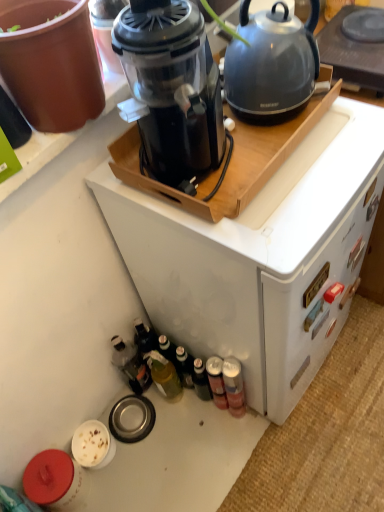
Measure the distance between metallic silver can at lower right, which is the third bottle from left to right, and camera.

metallic silver can at lower right, which is the third bottle from left to right, is 1.17 meters from camera.

In order to face metallic silver can at lower right, which is the third bottle from left to right, should I rotate leftwards or rightwards?

Turn right approximately 3.582 degrees to face it.

What is the approximate width of metallic silver can at lower right, the first bottle positioned from the right?

metallic silver can at lower right, the first bottle positioned from the right, is 2.70 inches in width.

Where is `translucent glass bottle at lower center, which is the 3th bottle from right to left`? translucent glass bottle at lower center, which is the 3th bottle from right to left is located at coordinates (164, 376).

Image resolution: width=384 pixels, height=512 pixels. What are the coordinates of `matte gray kettle at upper right` in the screenshot? It's located at (352, 53).

What are the coordinates of `metallic gray kettle at upper right` in the screenshot? It's located at (271, 64).

Locate an element on the screen. This screenshot has width=384, height=512. black plastic blender at upper center is located at coordinates (172, 86).

Describe the element at coordinates (172, 86) in the screenshot. The width and height of the screenshot is (384, 512). I see `black plastic blender at upper center` at that location.

Where is `metallic silver can at lower right, marked as the 2th bottle in a right-to-left arrangement`? The width and height of the screenshot is (384, 512). metallic silver can at lower right, marked as the 2th bottle in a right-to-left arrangement is located at coordinates (216, 381).

Would you consider metallic gray kettle at upper right to be distant from translucent glass bottle at lower center, the 2th bottle positioned from the left?

No, there isn't a large distance between metallic gray kettle at upper right and translucent glass bottle at lower center, the 2th bottle positioned from the left.

Between metallic gray kettle at upper right and translucent glass bottle at lower center, which is the 3th bottle from right to left, which one appears on the left side from the viewer's perspective?

From the viewer's perspective, translucent glass bottle at lower center, which is the 3th bottle from right to left, appears more on the left side.

From a real-world perspective, does metallic gray kettle at upper right stand above translucent glass bottle at lower center, the 2th bottle positioned from the left?

Yes.

Which is in front, metallic gray kettle at upper right or translucent glass bottle at lower center, the 2th bottle positioned from the left?

Positioned in front is metallic gray kettle at upper right.

From the metallic silver can at lower right, the first bottle positioned from the right, count the 1st bottle to the left and point to it. Please provide its 2D coordinates.

[(216, 381)]

Which is behind, point (235, 398) or point (217, 395)?

The point (217, 395) is farther.

Consider the image. Measure the distance between metallic silver can at lower right, which is the 4th bottle from left to right, and metallic silver can at lower right, which is the third bottle from left to right.

metallic silver can at lower right, which is the 4th bottle from left to right, is 1.38 inches away from metallic silver can at lower right, which is the third bottle from left to right.

From a real-world perspective, which object stands above the other?

metallic silver can at lower right, the first bottle positioned from the right.

Is metallic silver can at lower right, which is the third bottle from left to right, touching translucent glass bottle at lower center, the 2th bottle positioned from the left?

No, metallic silver can at lower right, which is the third bottle from left to right, is not in contact with translucent glass bottle at lower center, the 2th bottle positioned from the left.

From a real-world perspective, is metallic silver can at lower right, which is the third bottle from left to right, beneath translucent glass bottle at lower center, which is the 3th bottle from right to left?

Indeed, from a real-world perspective, metallic silver can at lower right, which is the third bottle from left to right, is positioned beneath translucent glass bottle at lower center, which is the 3th bottle from right to left.

Which is more to the left, black plastic blender at upper center or metallic gray kettle at upper right?

black plastic blender at upper center is more to the left.

From the image's perspective, is black plastic blender at upper center positioned above or below metallic gray kettle at upper right?

From the image's perspective, black plastic blender at upper center appears below metallic gray kettle at upper right.

Is black plastic blender at upper center wider or thinner than metallic gray kettle at upper right?

Considering their sizes, black plastic blender at upper center looks broader than metallic gray kettle at upper right.

Which object is further away from the camera, black plastic blender at upper center or metallic gray kettle at upper right?

metallic gray kettle at upper right is further away from the camera.

Consider the image. Which point is more forward, (226, 371) or (250, 109)?

The point (250, 109) is in front.

Is metallic silver can at lower right, which is the 4th bottle from left to right, oriented away from metallic gray kettle at upper right?

metallic silver can at lower right, which is the 4th bottle from left to right, is not turned away from metallic gray kettle at upper right.

You are a GUI agent. You are given a task and a screenshot of the screen. Output one action in this format:
    pyautogui.click(x=<x>, y=<y>)
    Task: Click on the kettle positioned vertically above the metallic silver can at lower right, which is the 4th bottle from left to right (from a real-world perspective)
    
    Given the screenshot: What is the action you would take?
    pyautogui.click(x=271, y=64)

In terms of height, does metallic silver can at lower right, the first bottle positioned from the right, look taller or shorter compared to metallic gray kettle at upper right?

metallic silver can at lower right, the first bottle positioned from the right, is taller than metallic gray kettle at upper right.

Where is `appliance that is under the black plastic blender at upper center (from a real-world perspective)`? The width and height of the screenshot is (384, 512). appliance that is under the black plastic blender at upper center (from a real-world perspective) is located at coordinates (352, 53).

From the picture: From a real-world perspective, is matte gray kettle at upper right located higher than black plastic blender at upper center?

Actually, matte gray kettle at upper right is physically below black plastic blender at upper center in the real world.

Considering the sizes of objects matte gray kettle at upper right and black plastic blender at upper center in the image provided, who is wider, matte gray kettle at upper right or black plastic blender at upper center?

black plastic blender at upper center.

Considering the relative sizes of metallic silver can at lower right, the first bottle positioned from the right, and black plastic blender at upper center in the image provided, is metallic silver can at lower right, the first bottle positioned from the right, thinner than black plastic blender at upper center?

Indeed, metallic silver can at lower right, the first bottle positioned from the right, has a lesser width compared to black plastic blender at upper center.

Considering the positions of point (234, 400) and point (175, 57), is point (234, 400) closer or farther from the camera than point (175, 57)?

Point (234, 400) appears to be farther away from the viewer than point (175, 57).

From the image's perspective, between metallic silver can at lower right, the first bottle positioned from the right, and black plastic blender at upper center, which one is located above?

black plastic blender at upper center appears higher in the image.

From a real-world perspective, who is located lower, metallic silver can at lower right, the first bottle positioned from the right, or black plastic blender at upper center?

From a 3D spatial view, metallic silver can at lower right, the first bottle positioned from the right, is below.

You are a GUI agent. You are given a task and a screenshot of the screen. Output one action in this format:
    pyautogui.click(x=<x>, y=<y>)
    Task: Click on the 3rd bottle to the left when counting from the metallic gray kettle at upper right
    
    Given the screenshot: What is the action you would take?
    pyautogui.click(x=164, y=376)

Where is `bottle lying on the right of metallic silver can at lower right, marked as the 2th bottle in a right-to-left arrangement`? bottle lying on the right of metallic silver can at lower right, marked as the 2th bottle in a right-to-left arrangement is located at coordinates (234, 386).

From the image, which object appears to be nearer to translucent plastic bottle at lower left, which is counted as the first bottle, starting from the left, metallic silver can at lower right, marked as the 2th bottle in a right-to-left arrangement, or black plastic blender at upper center?

metallic silver can at lower right, marked as the 2th bottle in a right-to-left arrangement, is positioned closer to the anchor translucent plastic bottle at lower left, which is counted as the first bottle, starting from the left.

Considering their positions, is black plastic blender at upper center positioned closer to matte gray kettle at upper right than metallic silver can at lower right, marked as the 2th bottle in a right-to-left arrangement?

black plastic blender at upper center.

When comparing their distances from metallic silver can at lower right, which is the 4th bottle from left to right, does translucent glass bottle at lower center, which is the 3th bottle from right to left, or metallic gray kettle at upper right seem closer?

translucent glass bottle at lower center, which is the 3th bottle from right to left.

Which object lies nearer to the anchor point matte gray kettle at upper right, metallic silver can at lower right, which is the third bottle from left to right, or translucent glass bottle at lower center, which is the 3th bottle from right to left?

Among the two, metallic silver can at lower right, which is the third bottle from left to right, is located nearer to matte gray kettle at upper right.

Consider the image. Considering their positions, is translucent glass bottle at lower center, which is the 3th bottle from right to left, positioned closer to metallic silver can at lower right, which is the third bottle from left to right, than translucent plastic bottle at lower left, which is counted as the first bottle, starting from the left?

translucent glass bottle at lower center, which is the 3th bottle from right to left.

Looking at the image, which one is located further to translucent glass bottle at lower center, which is the 3th bottle from right to left, matte gray kettle at upper right or metallic gray kettle at upper right?

matte gray kettle at upper right lies further to translucent glass bottle at lower center, which is the 3th bottle from right to left, than the other object.

Considering their positions, is black plastic blender at upper center positioned closer to translucent plastic bottle at lower left, the 4th bottle when ordered from right to left, than translucent glass bottle at lower center, the 2th bottle positioned from the left?

translucent glass bottle at lower center, the 2th bottle positioned from the left.

Looking at the image, which one is located closer to black plastic blender at upper center, translucent glass bottle at lower center, which is the 3th bottle from right to left, or matte gray kettle at upper right?

matte gray kettle at upper right lies closer to black plastic blender at upper center than the other object.

Locate an element on the screen. The width and height of the screenshot is (384, 512). bottle between matte gray kettle at upper right and translucent glass bottle at lower center, the 2th bottle positioned from the left, in the vertical direction is located at coordinates (131, 364).

Image resolution: width=384 pixels, height=512 pixels. Identify the location of blender between metallic gray kettle at upper right and translucent plastic bottle at lower left, the 4th bottle when ordered from right to left, from top to bottom. (172, 86).

Find the location of a particular element. This screenshot has height=512, width=384. bottle between translucent plastic bottle at lower left, which is counted as the first bottle, starting from the left, and metallic silver can at lower right, marked as the 2th bottle in a right-to-left arrangement, in the horizontal direction is located at coordinates (164, 376).

Identify the location of blender between metallic gray kettle at upper right and metallic silver can at lower right, which is the 4th bottle from left to right, in the vertical direction. (172, 86).